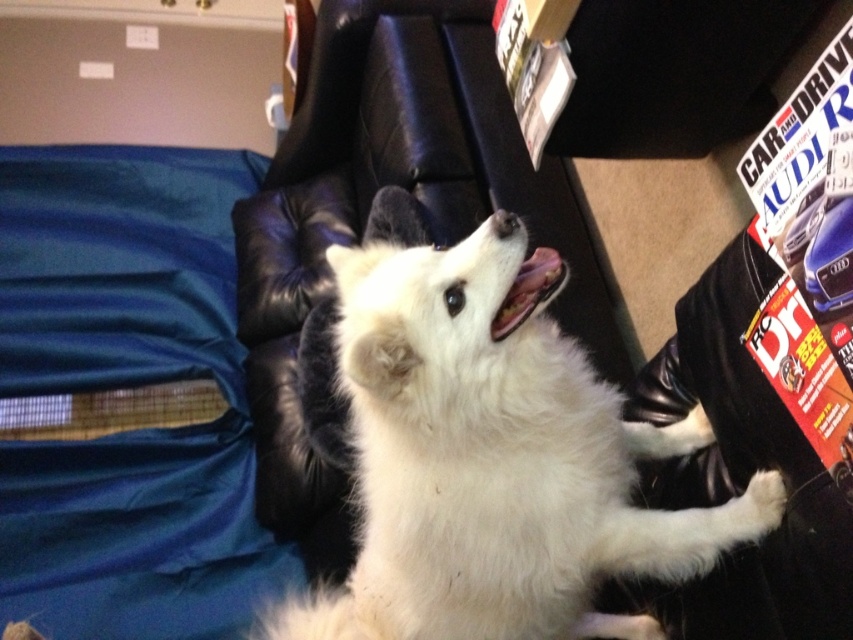
Question: Does white fluffy dog at center come behind black leather magazine rack at upper right?

Choices:
 (A) yes
 (B) no

Answer: (B)

Question: Which point appears farthest from the camera in this image?

Choices:
 (A) (469, 252)
 (B) (682, 115)

Answer: (B)

Question: Among these points, which one is farthest from the camera?

Choices:
 (A) (746, 35)
 (B) (495, 499)

Answer: (A)

Question: Where is white fluffy dog at center located in relation to black leather magazine rack at upper right in the image?

Choices:
 (A) above
 (B) below

Answer: (B)

Question: Is white fluffy dog at center below black leather magazine rack at upper right?

Choices:
 (A) no
 (B) yes

Answer: (B)